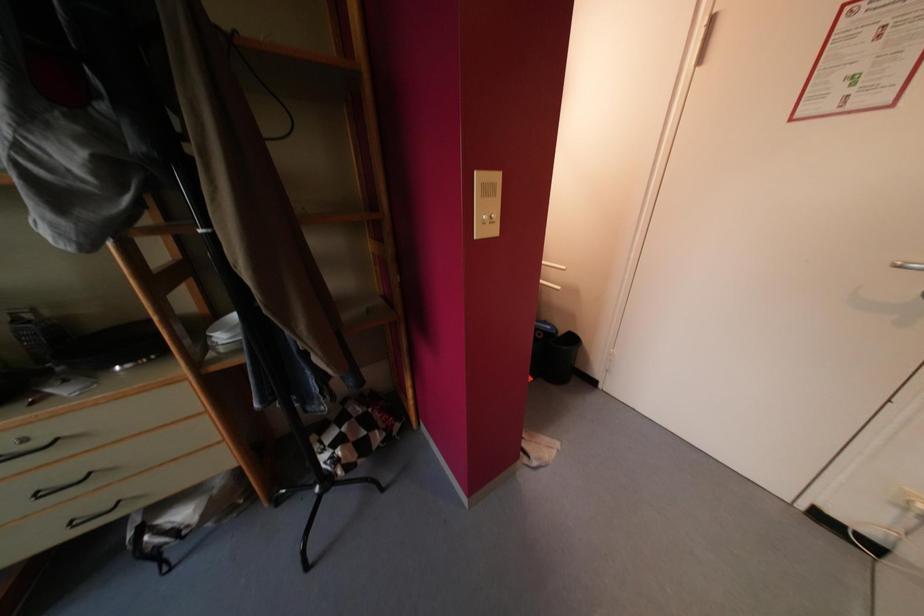
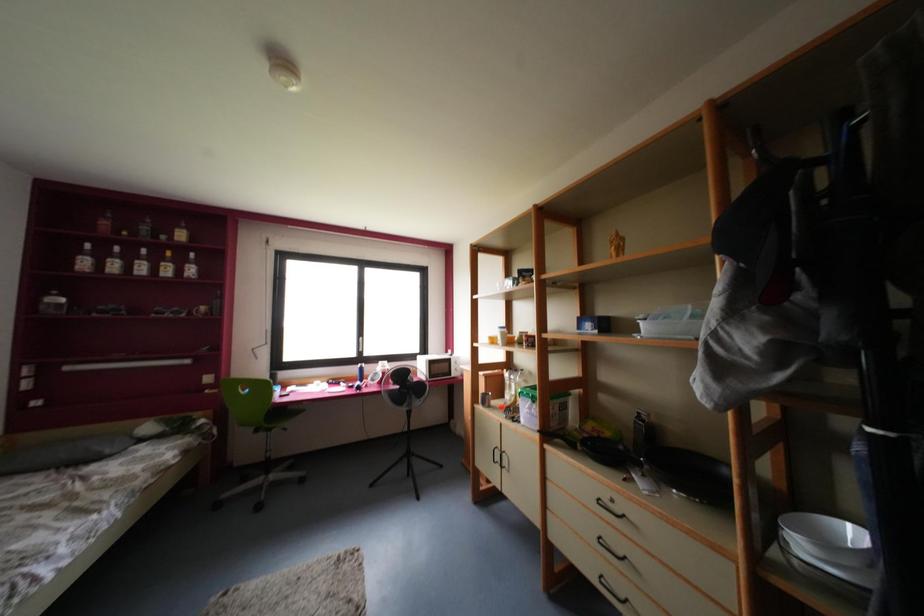
Question: The first image is from the beginning of the video and the second image is from the end. How did the camera likely rotate when shooting the video?

Choices:
 (A) Left
 (B) Right
 (C) Up
 (D) Down

Answer: (A)